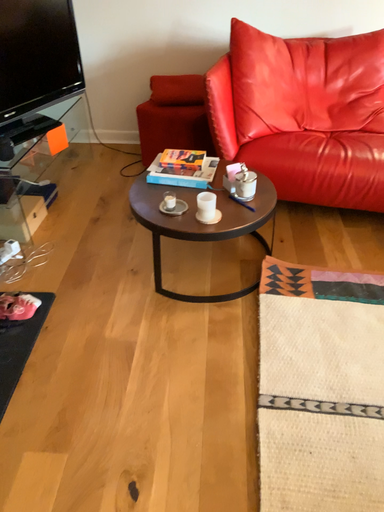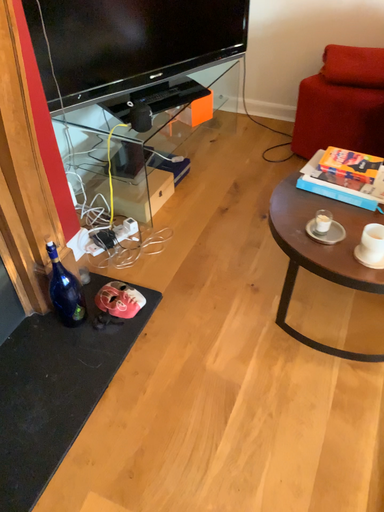
Question: How did the camera likely rotate when shooting the video?

Choices:
 (A) rotated right
 (B) rotated left

Answer: (B)